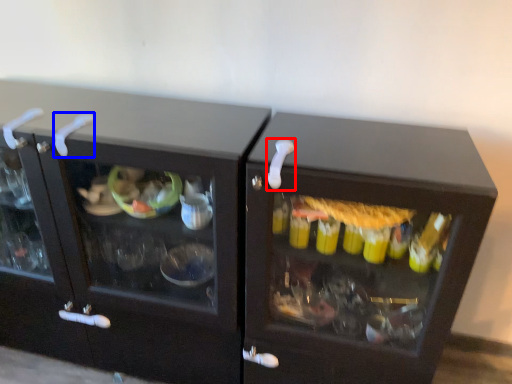
Question: Which of the following is the closest to the observer, door handle (highlighted by a red box) or door handle (highlighted by a blue box)?

Choices:
 (A) door handle
 (B) door handle

Answer: (A)